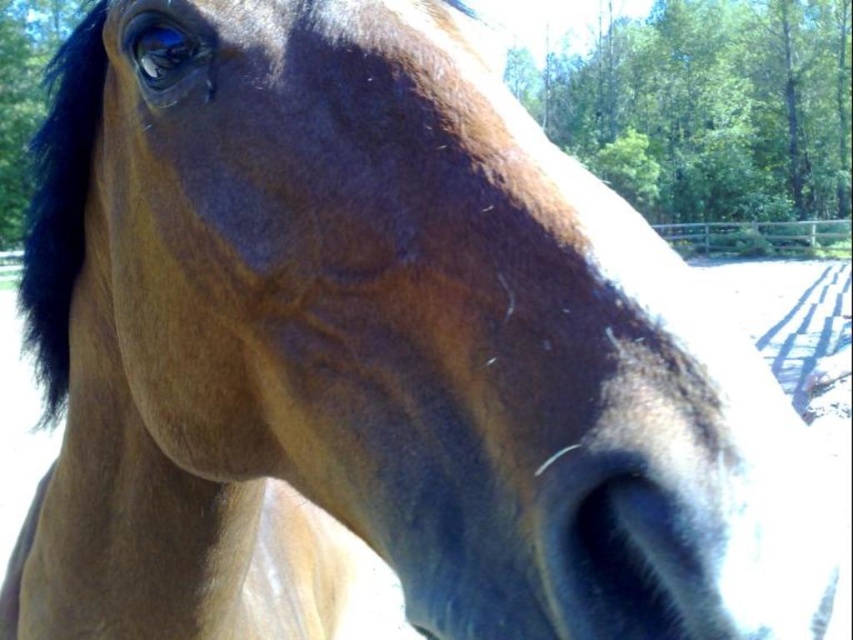
You are a photographer trying to capture the horse in the image. You want to ensure that both the black silky mane at left and the brown wooden fence at upper right are clearly visible in your shot. Based on their heights, which object should you focus on first to ensure proper focus?

The black silky mane at left is taller than the brown wooden fence at upper right, so you should focus on the black silky mane at left first to ensure proper focus.

You are a photographer holding a camera that is 12 inches wide. You want to take a portrait of the black silky mane at left without cropping any part of it. Can your camera frame the entire mane?

The distance between the black silky mane at left and the viewer is 24.53 inches. Since the camera is 12 inches wide, it can easily capture the entire black silky mane at left within its field of view without cropping.

You are a photographer trying to capture the horse in the image. You notice the black silky mane at left and the brown wooden fence at upper right. Which object should you focus on if you want to highlight something larger in your photo?

The black silky mane at left should be focused on because it has a larger size compared to the brown wooden fence at upper right.